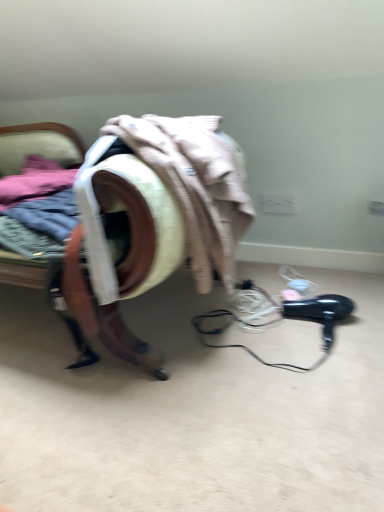
Image resolution: width=384 pixels, height=512 pixels. Describe the element at coordinates (320, 312) in the screenshot. I see `black plastic hair dryer at lower right` at that location.

Locate an element on the screen. The width and height of the screenshot is (384, 512). black plastic hair dryer at lower right is located at coordinates (320, 312).

What is the approximate height of black plastic hair dryer at lower right?

It is 11.17 centimeters.

At what (x,y) coordinates should I click in order to perform the action: click on velvet-like armchair at center. Please return your answer as a coordinate pair (x, y). The image size is (384, 512). Looking at the image, I should click on (138, 224).

Describe the element at coordinates (138, 224) in the screenshot. I see `velvet-like armchair at center` at that location.

Locate an element on the screen. This screenshot has height=512, width=384. black plastic hair dryer at lower right is located at coordinates (320, 312).

Looking at this image, between black plastic hair dryer at lower right and velvet-like armchair at center, which one appears on the right side from the viewer's perspective?

Positioned to the right is black plastic hair dryer at lower right.

Relative to velvet-like armchair at center, is black plastic hair dryer at lower right in front or behind?

Visually, black plastic hair dryer at lower right is located behind velvet-like armchair at center.

Considering the points (326, 334) and (158, 376), which point is in front, point (326, 334) or point (158, 376)?

The point (158, 376) is in front.

From the image's perspective, is black plastic hair dryer at lower right positioned above or below velvet-like armchair at center?

black plastic hair dryer at lower right is situated lower than velvet-like armchair at center in the image.

Consider the image. From a real-world perspective, is black plastic hair dryer at lower right positioned over velvet-like armchair at center based on gravity?

No, from a real-world perspective, black plastic hair dryer at lower right is not above velvet-like armchair at center.

Considering the relative sizes of black plastic hair dryer at lower right and velvet-like armchair at center in the image provided, is black plastic hair dryer at lower right wider than velvet-like armchair at center?

Incorrect, the width of black plastic hair dryer at lower right does not surpass that of velvet-like armchair at center.

In terms of height, does black plastic hair dryer at lower right look taller or shorter compared to velvet-like armchair at center?

Clearly, black plastic hair dryer at lower right is shorter compared to velvet-like armchair at center.

Does black plastic hair dryer at lower right have a larger size compared to velvet-like armchair at center?

No, black plastic hair dryer at lower right is not bigger than velvet-like armchair at center.

Is black plastic hair dryer at lower right not inside velvet-like armchair at center?

Indeed, black plastic hair dryer at lower right is completely outside velvet-like armchair at center.

Is there a large distance between black plastic hair dryer at lower right and velvet-like armchair at center?

→ That's not correct — black plastic hair dryer at lower right is a little close to velvet-like armchair at center.

Could you tell me if black plastic hair dryer at lower right is facing velvet-like armchair at center?

No, black plastic hair dryer at lower right is not aimed at velvet-like armchair at center.

The image size is (384, 512). I want to click on furniture in front of the black plastic hair dryer at lower right, so click(138, 224).

Between velvet-like armchair at center and black plastic hair dryer at lower right, which one appears on the right side from the viewer's perspective?

Positioned to the right is black plastic hair dryer at lower right.

Which is behind, velvet-like armchair at center or black plastic hair dryer at lower right?

black plastic hair dryer at lower right is more distant.

Which is in front, point (99, 332) or point (285, 314)?

Point (99, 332)

From the image's perspective, which object appears higher, velvet-like armchair at center or black plastic hair dryer at lower right?

From the image's view, velvet-like armchair at center is above.

Looking at this image, from a real-world perspective, does velvet-like armchair at center stand above black plastic hair dryer at lower right?

Yes, from a real-world perspective, velvet-like armchair at center is over black plastic hair dryer at lower right

In the scene shown: Between velvet-like armchair at center and black plastic hair dryer at lower right, which one has larger width?

velvet-like armchair at center is wider.

Considering the relative sizes of velvet-like armchair at center and black plastic hair dryer at lower right in the image provided, is velvet-like armchair at center shorter than black plastic hair dryer at lower right?

In fact, velvet-like armchair at center may be taller than black plastic hair dryer at lower right.

Consider the image. Which of these two, velvet-like armchair at center or black plastic hair dryer at lower right, is bigger?

velvet-like armchair at center is bigger.

Would you say velvet-like armchair at center is outside black plastic hair dryer at lower right?

Yes, velvet-like armchair at center is outside of black plastic hair dryer at lower right.

Would you consider velvet-like armchair at center to be distant from black plastic hair dryer at lower right?

No, velvet-like armchair at center is not far away from black plastic hair dryer at lower right.

Is black plastic hair dryer at lower right at the back of velvet-like armchair at center?

No, velvet-like armchair at center is not facing away from black plastic hair dryer at lower right.

Where is `hair drier on the right of velvet-like armchair at center`? The image size is (384, 512). hair drier on the right of velvet-like armchair at center is located at coordinates (320, 312).

The height and width of the screenshot is (512, 384). In the image, there is a velvet-like armchair at center. What are the coordinates of `hair drier below it (from a real-world perspective)` in the screenshot? It's located at (320, 312).

Identify the location of furniture above the black plastic hair dryer at lower right (from the image's perspective). (138, 224).